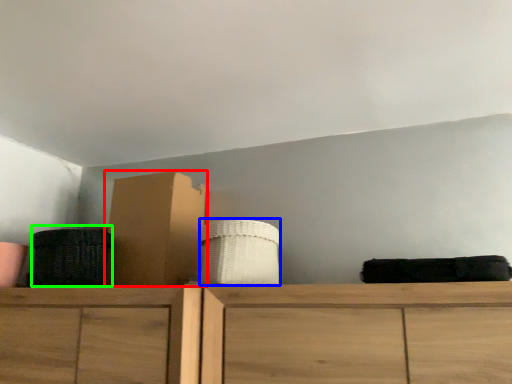
Question: Which object is the closest to the cardboard box (highlighted by a red box)? Choose among these: basket (highlighted by a blue box) or basket (highlighted by a green box).

Choices:
 (A) basket
 (B) basket

Answer: (B)